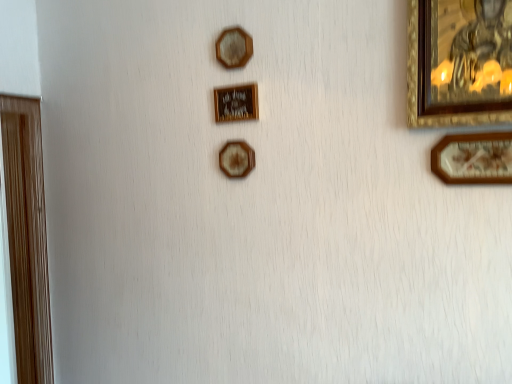
Question: Would you say wooden hexagon at upper center, the 3th picture frame when ordered from front to back, is to the left or to the right of gold metallic picture frame at center, acting as the 3th picture frame starting from the right, in the picture?

Choices:
 (A) left
 (B) right

Answer: (A)

Question: Considering the positions of point (245, 51) and point (247, 84), is point (245, 51) closer or farther from the camera than point (247, 84)?

Choices:
 (A) closer
 (B) farther

Answer: (A)

Question: Based on their relative distances, which object is nearer to the wooden hexagon at upper center, the 3th picture frame when ordered from front to back?

Choices:
 (A) wooden picture frame at right, the first picture frame in the front-to-back sequence
 (B) gold metallic picture frame at center, the 4th picture frame from the left
 (C) gold-framed painting at upper right, arranged as the 2th picture frame when viewed from the right
 (D) wooden hexagon at center, the 3th picture frame positioned from the left
 (E) wooden door at left, which is the 1th picture frame in left-to-right order

Answer: (B)

Question: Which object is the farthest from the wooden hexagon at upper center, the 3th picture frame when ordered from front to back?

Choices:
 (A) wooden picture frame at right, marked as the 6th picture frame in a left-to-right arrangement
 (B) wooden hexagon at center, the 3th picture frame positioned from the left
 (C) gold-framed painting at upper right, which ranks as the 5th picture frame in back-to-front order
 (D) gold metallic picture frame at center, acting as the third picture frame starting from the back
 (E) wooden door at left, positioned as the sixth picture frame in front-to-back order

Answer: (E)